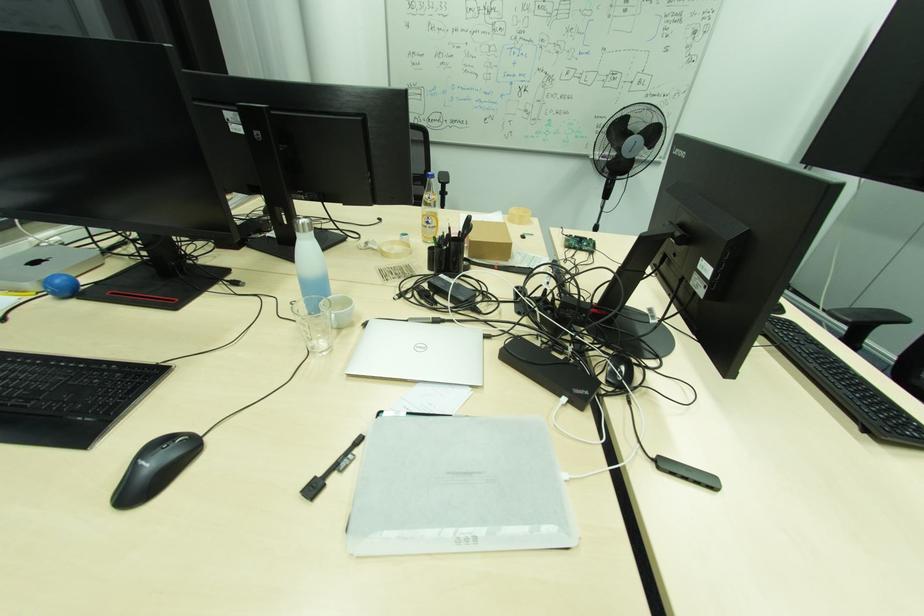
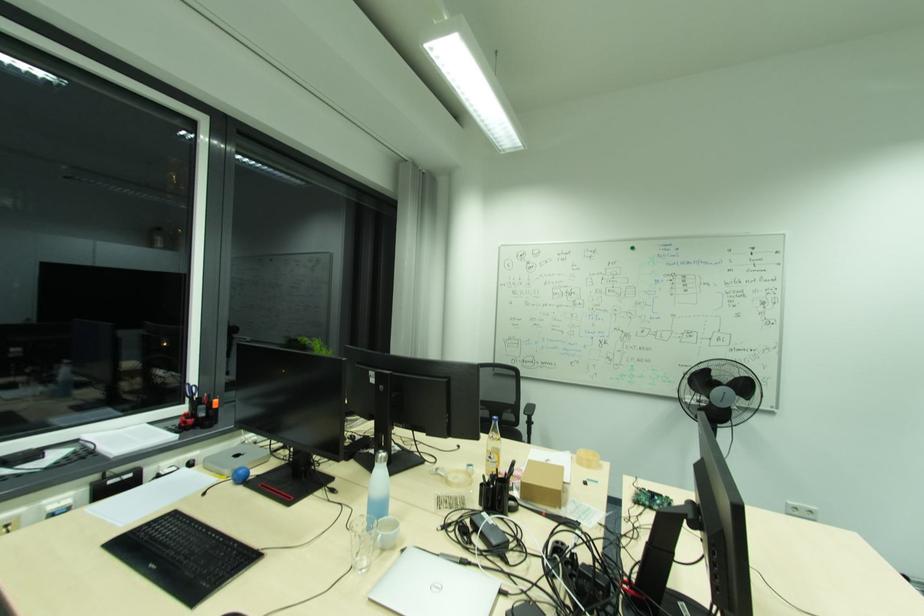
The point at (x=324, y=351) is marked in the first image. Where is the corresponding point in the second image?

(363, 568)